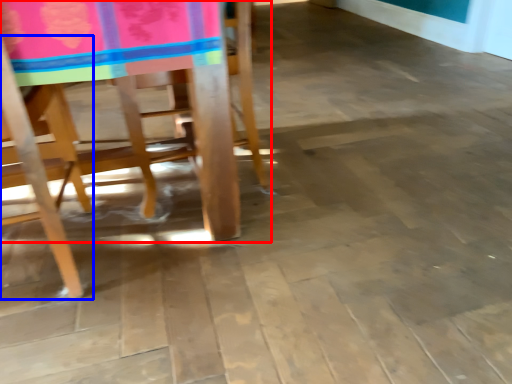
Question: Which point is closer to the camera, chair (highlighted by a red box) or chair (highlighted by a blue box)?

Choices:
 (A) chair
 (B) chair

Answer: (B)